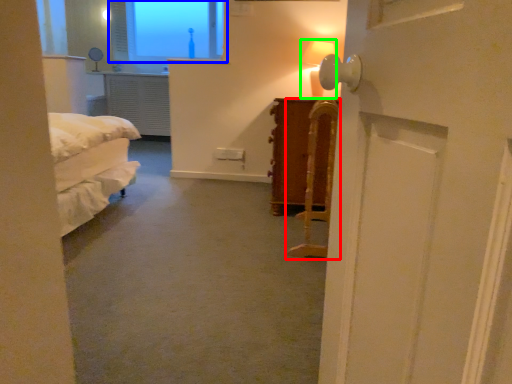
Question: Which is farther away from furniture (highlighted by a red box)? window (highlighted by a blue box) or table lamp (highlighted by a green box)?

Choices:
 (A) window
 (B) table lamp

Answer: (A)